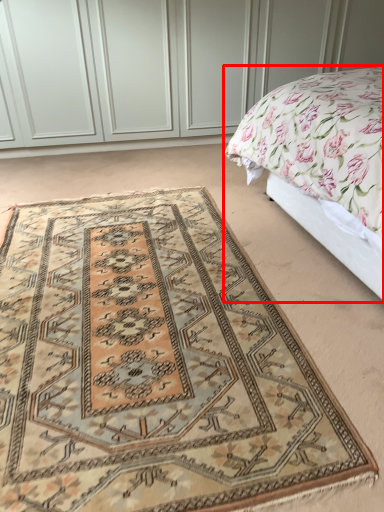
Question: From the image's perspective, what is the correct spatial positioning of bed (annotated by the red box) in reference to mat?

Choices:
 (A) below
 (B) above

Answer: (B)